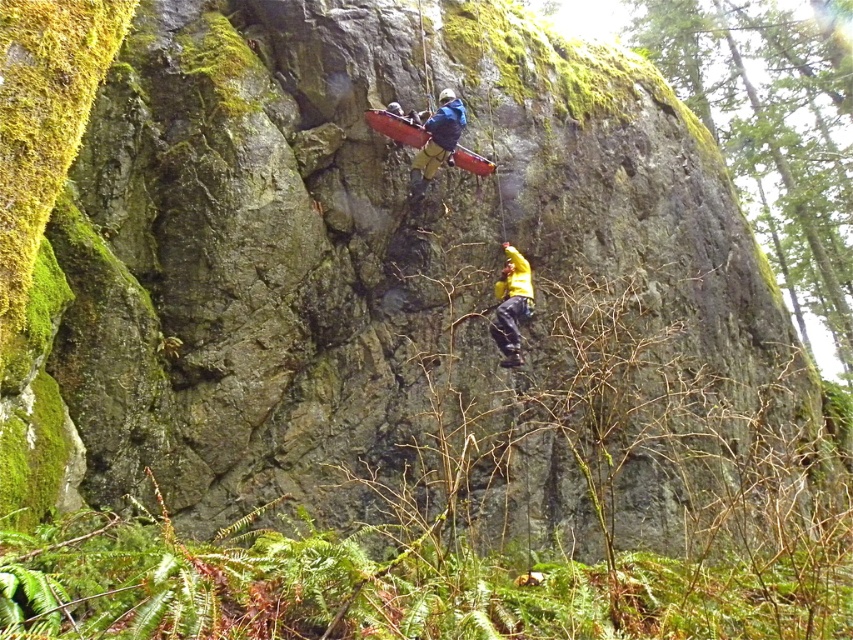
Between yellow fabric at center and blue fabric harness at upper center, which one appears on the left side from the viewer's perspective?

blue fabric harness at upper center

Is point (509, 310) in front of point (422, 164)?

Yes, it is in front of point (422, 164).

You are a GUI agent. You are given a task and a screenshot of the screen. Output one action in this format:
    pyautogui.click(x=<x>, y=<y>)
    Task: Click on the yellow fabric at center
    The width and height of the screenshot is (853, 640).
    Given the screenshot: What is the action you would take?
    pyautogui.click(x=511, y=305)